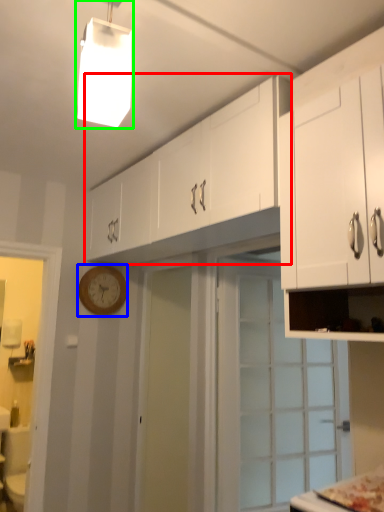
Question: Based on their relative distances, which object is nearer to cabinetry (highlighted by a red box)? Choose from clock (highlighted by a blue box) and light fixture (highlighted by a green box).

Choices:
 (A) clock
 (B) light fixture

Answer: (A)